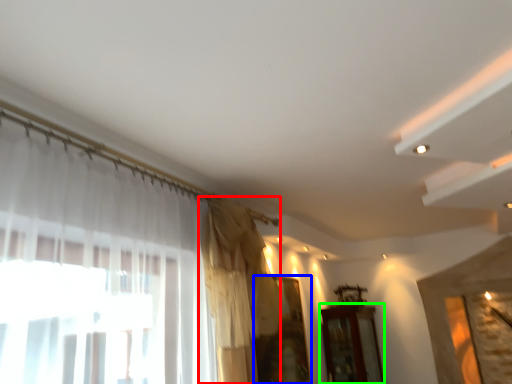
Question: Based on their relative distances, which object is farther from curtain (highlighted by a red box)? Choose from window (highlighted by a blue box) and furniture (highlighted by a green box).

Choices:
 (A) window
 (B) furniture

Answer: (B)